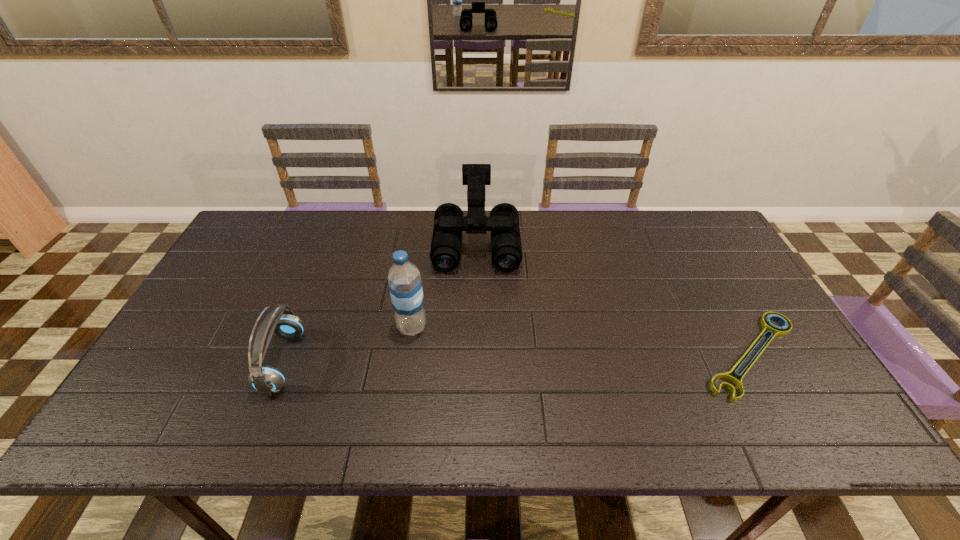
Where is `free space on the desktop that is between the headset and the wrench and is positioned on the label of the water bottle`? This screenshot has width=960, height=540. free space on the desktop that is between the headset and the wrench and is positioned on the label of the water bottle is located at coordinates (475, 359).

This screenshot has width=960, height=540. I want to click on vacant spot on the desktop that is between the headset and the shortest object and is positioned on the front lenses of the third shortest object, so click(475, 359).